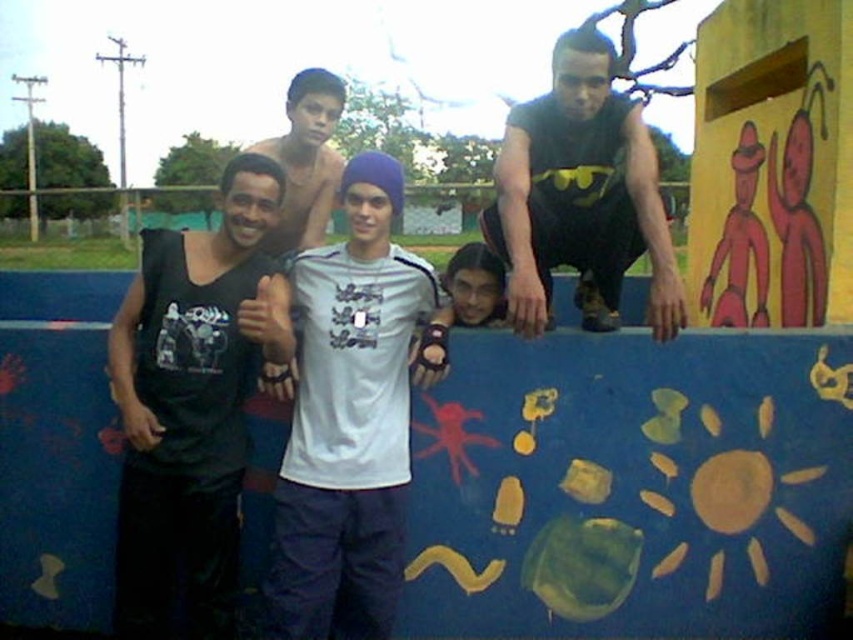
Measure the distance between black matte tank top at upper right and camera.

10.25 feet

Can you confirm if black matte tank top at upper right is shorter than smooth skin face at center?

Incorrect, black matte tank top at upper right's height does not fall short of smooth skin face at center's.

Is point (537, 116) farther from camera compared to point (477, 321)?

Yes, point (537, 116) is farther from viewer.

Where is `black matte tank top at upper right`? The image size is (853, 640). black matte tank top at upper right is located at coordinates (579, 195).

Looking at this image, how far apart are black matte tank top at left and smooth skin face at center?

3.87 feet

Does black matte tank top at left lie in front of smooth skin face at center?

Yes, black matte tank top at left is in front of smooth skin face at center.

Identify the location of black matte tank top at left. This screenshot has height=640, width=853. (192, 403).

I want to click on black matte tank top at left, so click(x=192, y=403).

Can you confirm if black matte tank top at left is bigger than black matte tank top at upper right?

Yes, black matte tank top at left is bigger than black matte tank top at upper right.

Is the position of black matte tank top at left more distant than that of black matte tank top at upper right?

No.

Measure the distance between point (149, 234) and camera.

A distance of 9.72 feet exists between point (149, 234) and camera.

Find the location of a particular element. black matte tank top at left is located at coordinates (192, 403).